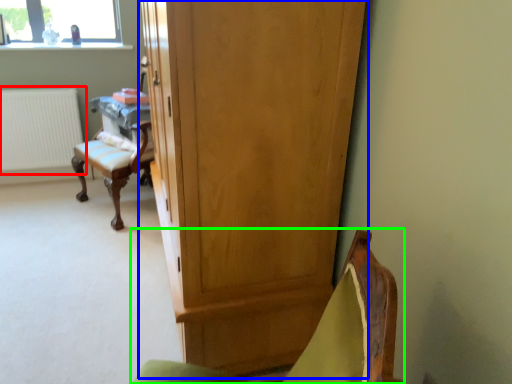
Question: Which object is the farthest from radiator (highlighted by a red box)? Choose among these: cupboard (highlighted by a blue box) or chair (highlighted by a green box).

Choices:
 (A) cupboard
 (B) chair

Answer: (B)